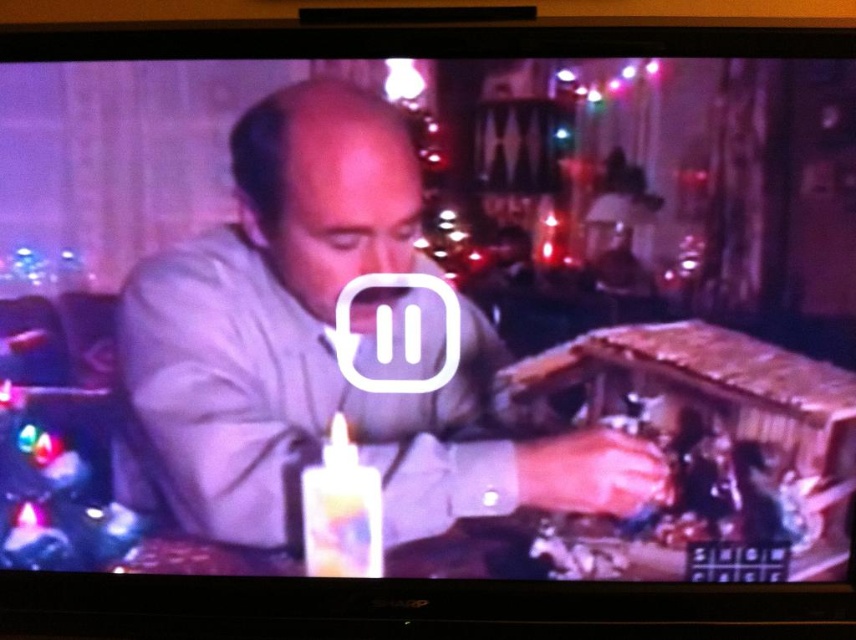
You are a guest at a birthday party and notice the matte gray shirt at center and the white glossy birthday candle at lower center. Which object is covering the other?

The matte gray shirt at center is positioned over white glossy birthday candle at lower center, so the shirt is covering the candle.

You are a guest at a party and see the matte gray shirt at center and the white glossy birthday candle at lower center on the table. Which object is closer to the left side of the table?

The matte gray shirt at center is to the left of the white glossy birthday candle at lower center, so it is closer to the left side of the table.

You are a photographer trying to capture a closeup of the white glossy birthday candle at lower center without the matte gray shirt at center being in the frame. Is the candle wide enough to fit within the camera view without the shirt overlapping?

The matte gray shirt at center is wider than the white glossy birthday candle at lower center, so the shirt may still overlap the candle in the frame unless the camera is positioned carefully to avoid it.